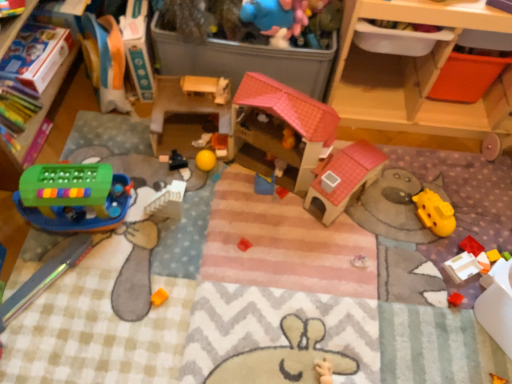
In order to click on free space between bright red plastic block at lower right, the ninth toy positioned from the left, and green plastic boat at left, the ninth toy viewed from the right in this screenshot , I will do `click(279, 235)`.